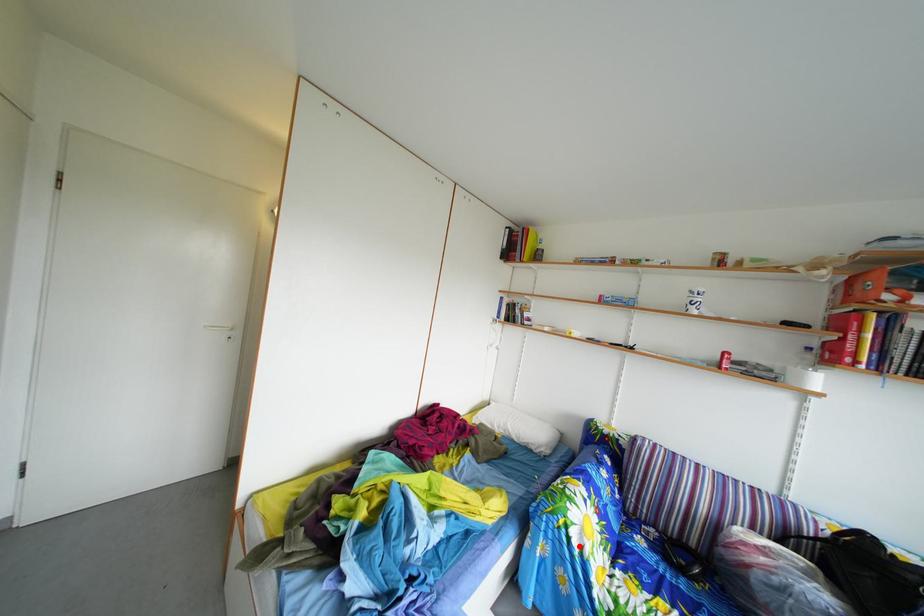
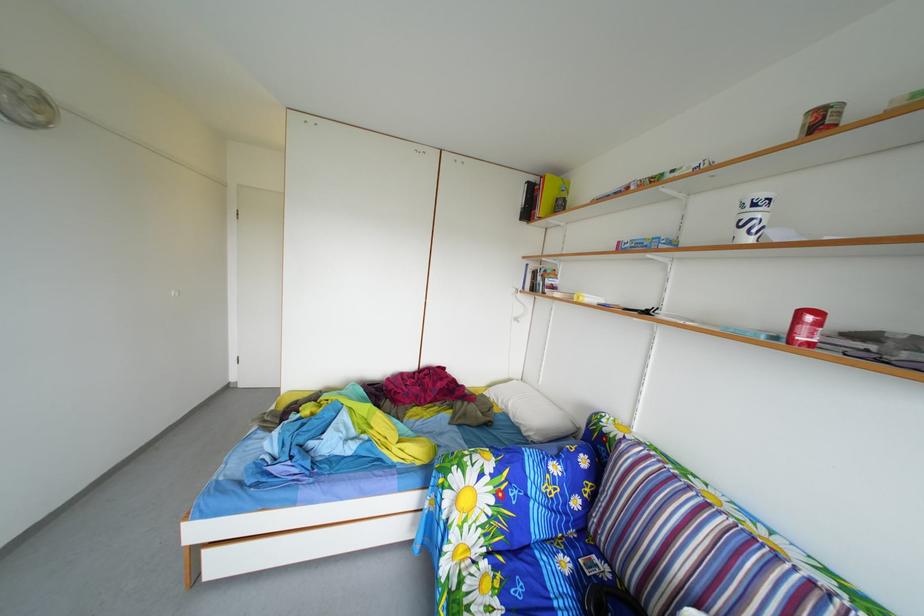
Locate, in the second image, the point that corresponds to the highlighted location in the first image.

(453, 507)